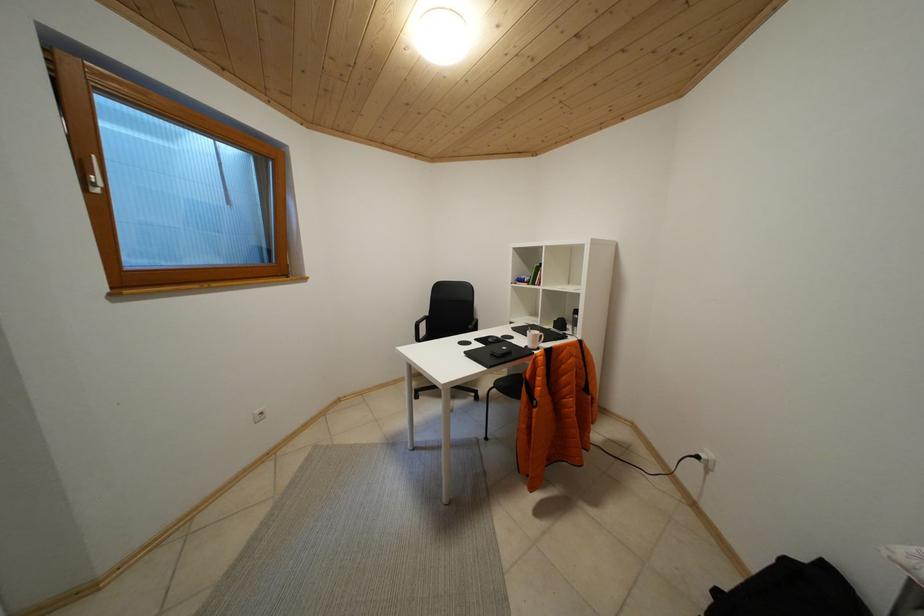
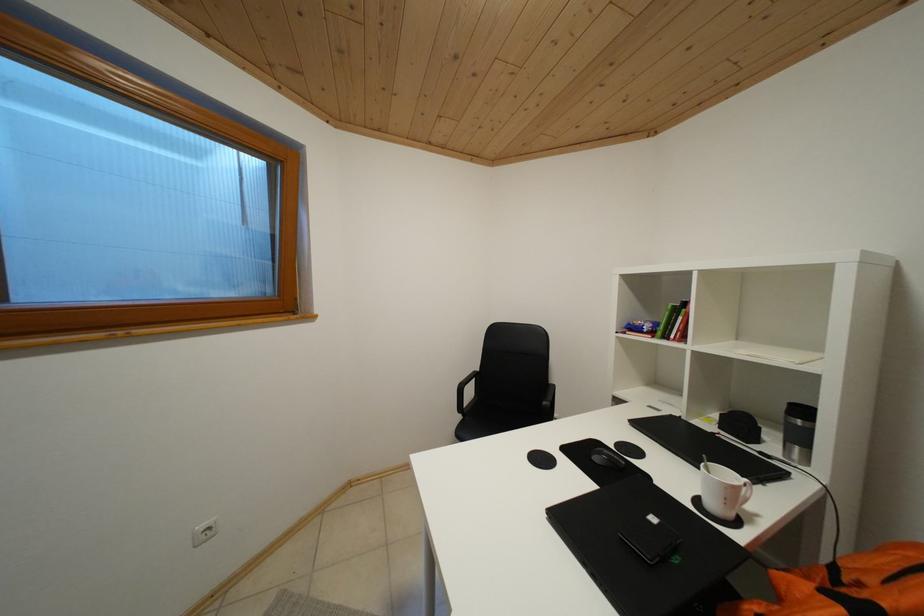
Question: The first image is from the beginning of the video and the second image is from the end. How did the camera likely rotate when shooting the video?

Choices:
 (A) Left
 (B) Right
 (C) Up
 (D) Down

Answer: (A)